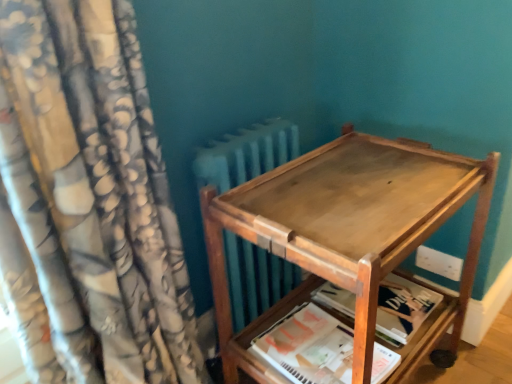
Where is `free spot above white paper at lower center, the second paperback book when ordered from back to front (from a real-world perspective)`? free spot above white paper at lower center, the second paperback book when ordered from back to front (from a real-world perspective) is located at coordinates (308, 353).